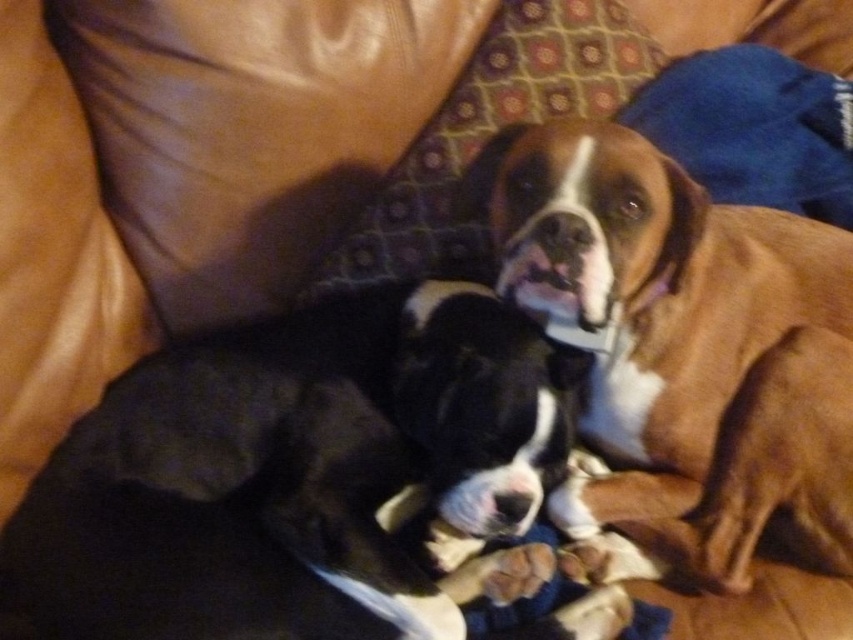
Is point (757, 500) closer to viewer compared to point (519, 548)?

No, (757, 500) is behind (519, 548).

Can you confirm if brown smooth dog at upper right is bigger than brown fuzzy paw at lower center?

Correct, brown smooth dog at upper right is larger in size than brown fuzzy paw at lower center.

Which is behind, point (675, 508) or point (486, 593)?

The point (675, 508) is more distant.

The image size is (853, 640). Identify the location of brown smooth dog at upper right. (683, 348).

Who is higher up, black smooth dog at center or brown smooth dog at upper right?

Positioned higher is brown smooth dog at upper right.

Is black smooth dog at center below brown smooth dog at upper right?

Yes, black smooth dog at center is below brown smooth dog at upper right.

Who is more distant from viewer, (503, 412) or (659, 150)?

Positioned behind is point (659, 150).

This screenshot has width=853, height=640. Identify the location of black smooth dog at center. (296, 472).

Can you confirm if patterned fabric pillow at upper center is bigger than brown fuzzy paw at lower center?

Indeed, patterned fabric pillow at upper center has a larger size compared to brown fuzzy paw at lower center.

Who is more forward, (483,35) or (544,580)?

Point (544,580) is in front.

Image resolution: width=853 pixels, height=640 pixels. What do you see at coordinates (486, 134) in the screenshot?
I see `patterned fabric pillow at upper center` at bounding box center [486, 134].

Locate an element on the screen. The width and height of the screenshot is (853, 640). patterned fabric pillow at upper center is located at coordinates click(486, 134).